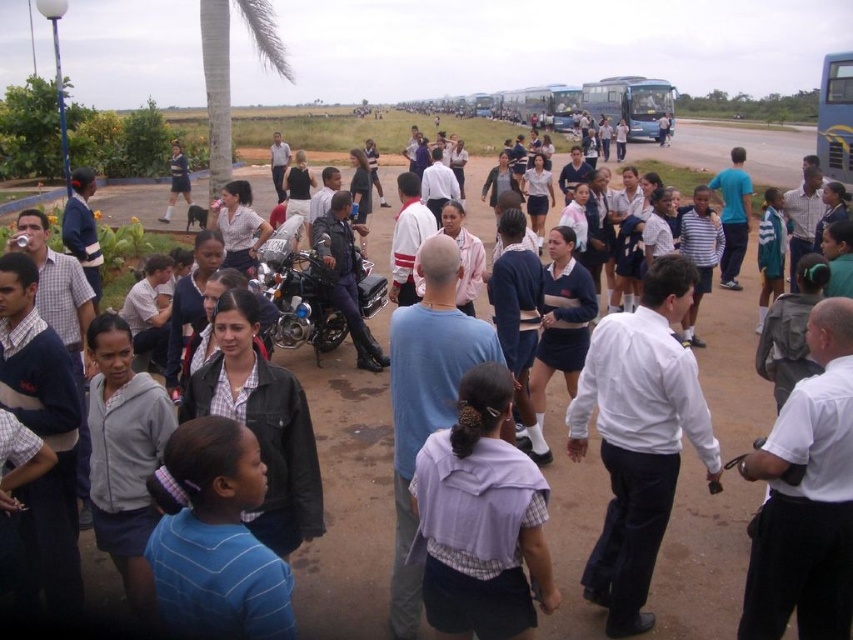
Based on the photo, is purple fabric shirt at center smaller than leather jacket at center?

Yes, purple fabric shirt at center is smaller than leather jacket at center.

Is purple fabric shirt at center shorter than leather jacket at center?

Yes.

Between point (521, 602) and point (315, 227), which one is positioned behind?

The point (315, 227) is more distant.

At what (x,y) coordinates should I click in order to perform the action: click on purple fabric shirt at center. Please return your answer as a coordinate pair (x, y). Looking at the image, I should click on (480, 520).

From the picture: Can you confirm if purple fabric shirt at center is bigger than green textured palm tree at upper left?

No.

Does purple fabric shirt at center appear over green textured palm tree at upper left?

Incorrect, purple fabric shirt at center is not positioned above green textured palm tree at upper left.

You are a GUI agent. You are given a task and a screenshot of the screen. Output one action in this format:
    pyautogui.click(x=<x>, y=<y>)
    Task: Click on the purple fabric shirt at center
    This screenshot has width=853, height=640.
    Given the screenshot: What is the action you would take?
    pyautogui.click(x=480, y=520)

Find the location of `purple fabric shirt at center`. purple fabric shirt at center is located at coordinates (480, 520).

Which is more to the left, white shirt at center or purple fabric shirt at center?

Positioned to the left is purple fabric shirt at center.

Is point (672, 342) positioned in front of point (421, 499)?

No, (672, 342) is behind (421, 499).

I want to click on white shirt at center, so click(x=639, y=436).